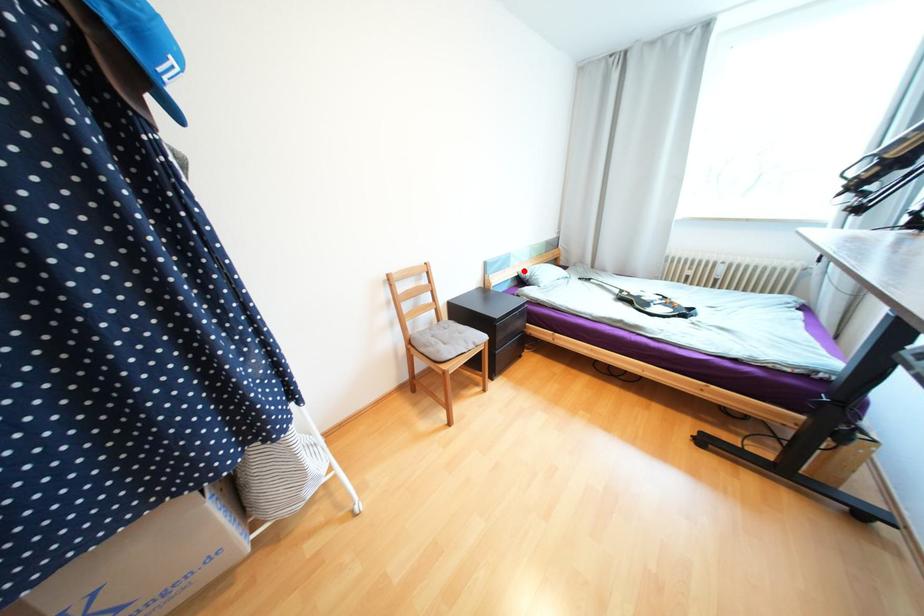
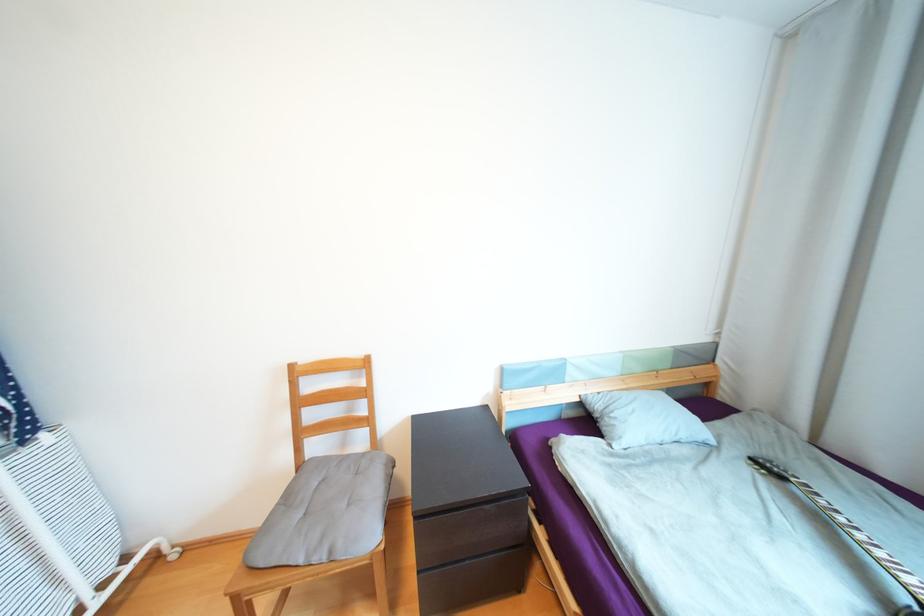
Question: I am providing you with two images of the same scene from different viewpoints. In image1, a red point is highlighted. Considering the same 3D point in image2, which of the following is correct?

Choices:
 (A) It is closer
 (B) It is farther

Answer: (B)